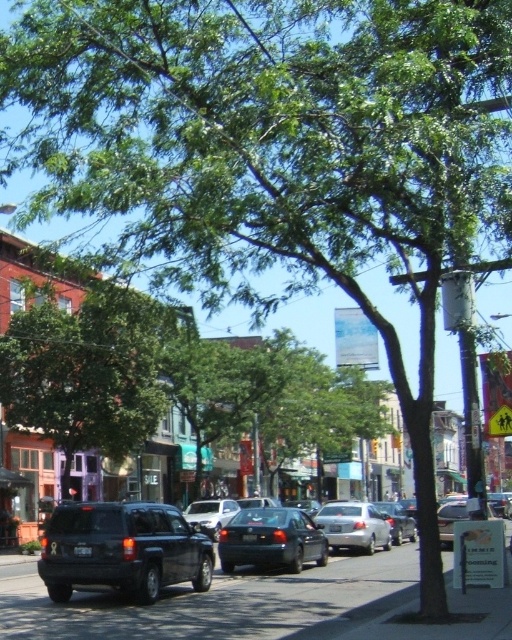
Question: Estimate the real-world distances between objects in this image. Which object is closer to the green leafy tree at center?

Choices:
 (A) matte black suv at center
 (B) white matte sedan at center

Answer: (B)

Question: Is shiny black sedan at center behind silver metallic sedan at center?

Choices:
 (A) yes
 (B) no

Answer: (B)

Question: Does dark gray asphalt at lower center come in front of green leafy tree at center?

Choices:
 (A) no
 (B) yes

Answer: (B)

Question: Which point is farther to the camera?

Choices:
 (A) (156, 636)
 (B) (131, 410)

Answer: (B)

Question: Is shiny black sedan at center wider than white matte sedan at center?

Choices:
 (A) no
 (B) yes

Answer: (B)

Question: Which object appears closest to the camera in this image?

Choices:
 (A) dark gray asphalt at lower center
 (B) white matte sedan at center
 (C) matte black suv at center

Answer: (A)